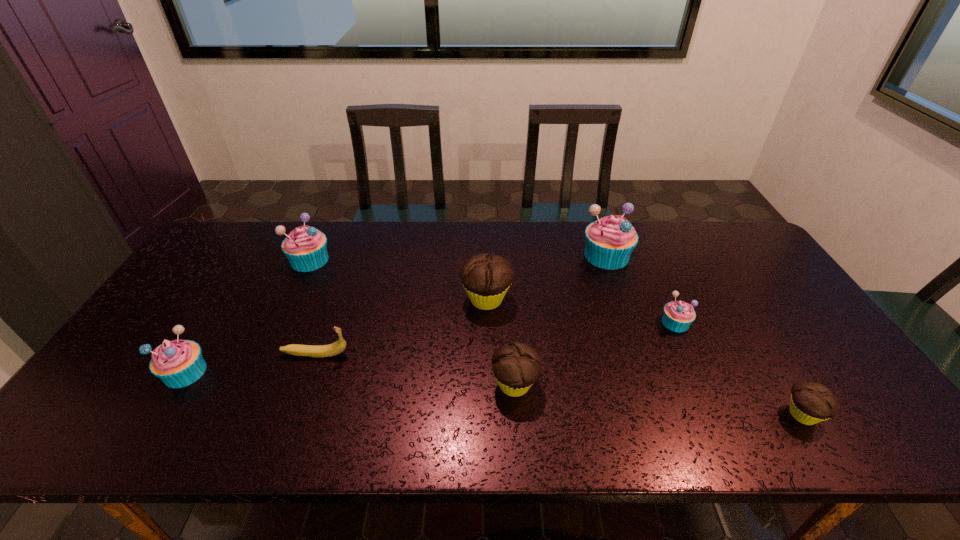
I want to click on free space located 0.370m on the left of the smallest chocolate muffin, so click(621, 415).

At what (x,y) coordinates should I click in order to perform the action: click on object located in the near edge section of the desktop. Please return your answer as a coordinate pair (x, y). Looking at the image, I should click on click(811, 402).

The image size is (960, 540). What are the coordinates of `object present at the left edge` in the screenshot? It's located at (178, 363).

Locate an element on the screen. This screenshot has width=960, height=540. object that is at the right edge is located at coordinates point(811,402).

The height and width of the screenshot is (540, 960). I want to click on object at the near right corner, so click(x=811, y=402).

Image resolution: width=960 pixels, height=540 pixels. I want to click on free region at the far edge of the desktop, so click(x=515, y=222).

Locate an element on the screen. The width and height of the screenshot is (960, 540). free space at the near edge is located at coordinates (293, 441).

Locate an element on the screen. Image resolution: width=960 pixels, height=540 pixels. blank space at the right edge is located at coordinates (761, 333).

Find the location of a particular element. The height and width of the screenshot is (540, 960). free point at the near left corner is located at coordinates (102, 443).

This screenshot has width=960, height=540. What are the coordinates of `vacant space at the far right corner` in the screenshot? It's located at (753, 246).